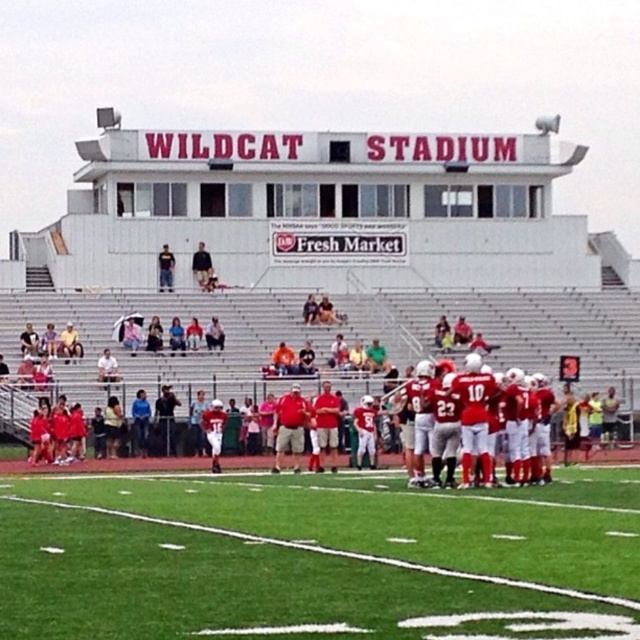
You are a photographer standing at the edge of the football field. You want to take a photo that includes both the green artificial turf at center and the red matte jersey at center. Which object will appear closer to the bottom of the photo?

The green artificial turf at center is not as tall as the red matte jersey at center, so the green artificial turf at center will appear closer to the bottom of the photo.

You are a photographer standing at the edge of the field. You want to take a photo that includes both the green artificial turf at center and the red matte jersey at center. Which object will appear larger in your photo?

The green artificial turf at center will appear larger in the photo because it is closer to the viewer than the red matte jersey at center.